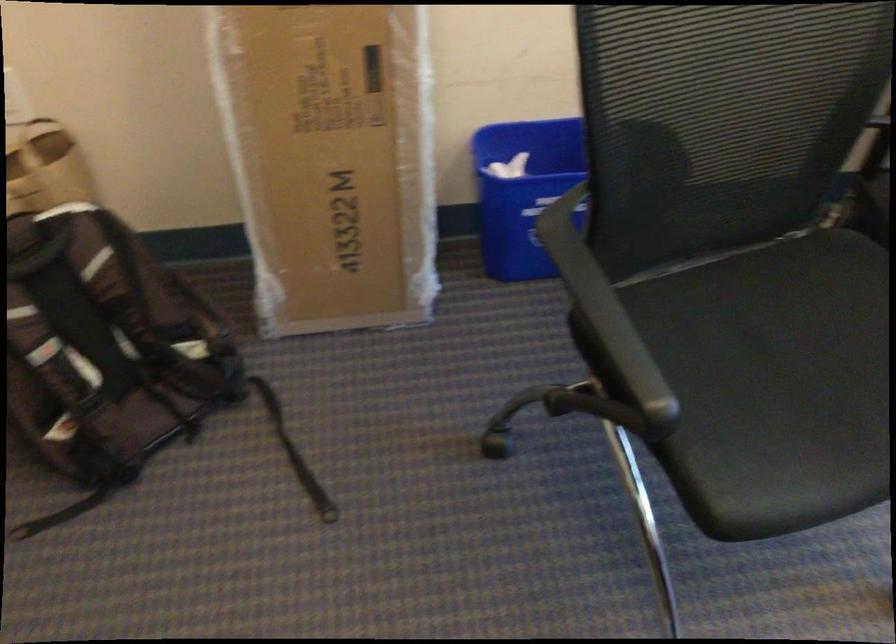
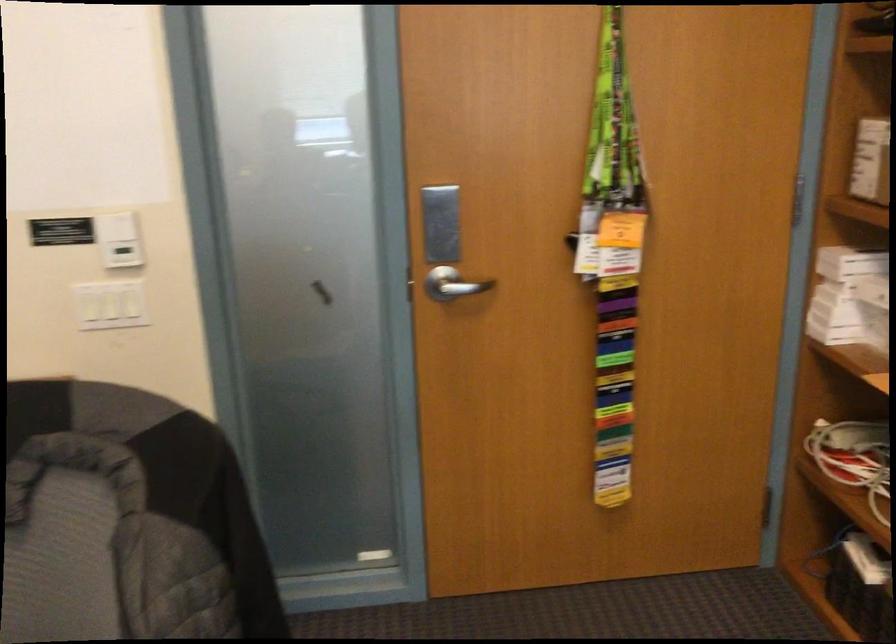
Question: The camera is either moving clockwise (left) or counter-clockwise (right) around the object. The first image is from the beginning of the video and the second image is from the end. Is the camera moving left or right when shooting the video?

Choices:
 (A) Left
 (B) Right

Answer: (B)